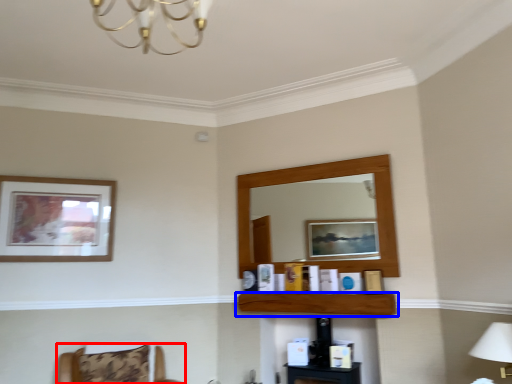
Question: Which point is further to the camera, furniture (highlighted by a red box) or shelf (highlighted by a blue box)?

Choices:
 (A) furniture
 (B) shelf

Answer: (B)